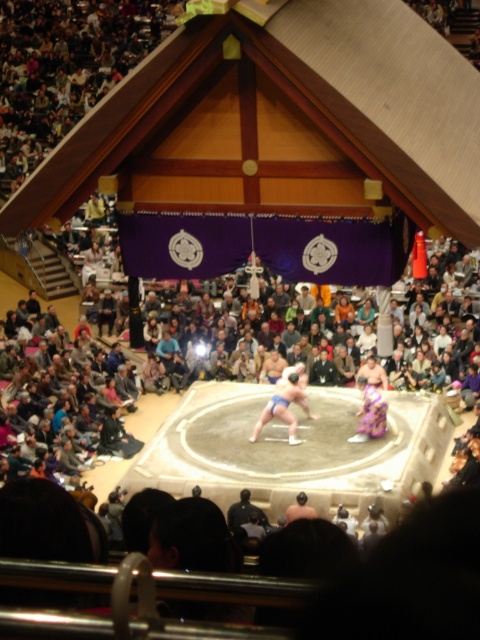
Question: Among these points, which one is nearest to the camera?

Choices:
 (A) (301, 392)
 (B) (241, 515)

Answer: (B)

Question: Considering the relative positions of blue fabric sumo at center and dark blue fabric kimono at center in the image provided, where is blue fabric sumo at center located with respect to dark blue fabric kimono at center?

Choices:
 (A) left
 (B) right

Answer: (B)

Question: Does blue fabric sumo at center come behind dark blue fabric kimono at center?

Choices:
 (A) yes
 (B) no

Answer: (A)

Question: Which object is closer to the camera taking this photo?

Choices:
 (A) dark blue fabric kimono at center
 (B) blue fabric sumo at center

Answer: (A)

Question: Does blue fabric sumo at center appear over dark blue fabric kimono at center?

Choices:
 (A) no
 (B) yes

Answer: (B)